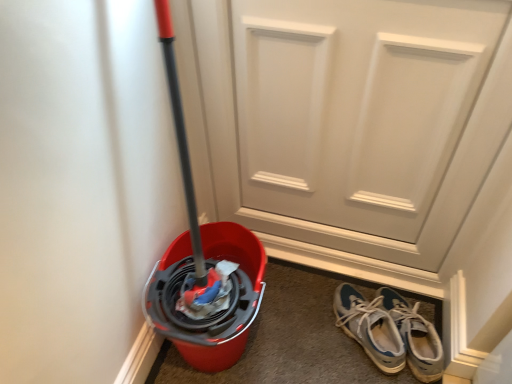
Question: Is blue suede sneakers at lower right shorter than white matte door at center?

Choices:
 (A) yes
 (B) no

Answer: (A)

Question: Is blue suede sneakers at lower right facing towards white matte door at center?

Choices:
 (A) no
 (B) yes

Answer: (A)

Question: Is blue suede sneakers at lower right looking in the opposite direction of white matte door at center?

Choices:
 (A) no
 (B) yes

Answer: (B)

Question: Are blue suede sneakers at lower right and white matte door at center beside each other?

Choices:
 (A) no
 (B) yes

Answer: (A)

Question: Does blue suede sneakers at lower right have a smaller size compared to white matte door at center?

Choices:
 (A) yes
 (B) no

Answer: (A)

Question: From the image's perspective, does blue suede sneakers at lower right appear higher than white matte door at center?

Choices:
 (A) yes
 (B) no

Answer: (B)

Question: Is white matte door at center further to the viewer compared to blue suede sneakers at lower right?

Choices:
 (A) yes
 (B) no

Answer: (B)

Question: Considering the relative positions of white matte door at center and blue suede sneakers at lower right in the image provided, is white matte door at center to the right of blue suede sneakers at lower right from the viewer's perspective?

Choices:
 (A) no
 (B) yes

Answer: (A)

Question: Is white matte door at center wider than blue suede sneakers at lower right?

Choices:
 (A) yes
 (B) no

Answer: (B)

Question: Is there a large distance between white matte door at center and blue suede sneakers at lower right?

Choices:
 (A) no
 (B) yes

Answer: (A)

Question: Can you confirm if white matte door at center is bigger than blue suede sneakers at lower right?

Choices:
 (A) yes
 (B) no

Answer: (A)

Question: Is the position of white matte door at center less distant than that of blue suede sneakers at lower right?

Choices:
 (A) yes
 (B) no

Answer: (A)

Question: From a real-world perspective, relative to blue suede sneakers at lower right, is white matte door at center vertically above or below?

Choices:
 (A) above
 (B) below

Answer: (A)